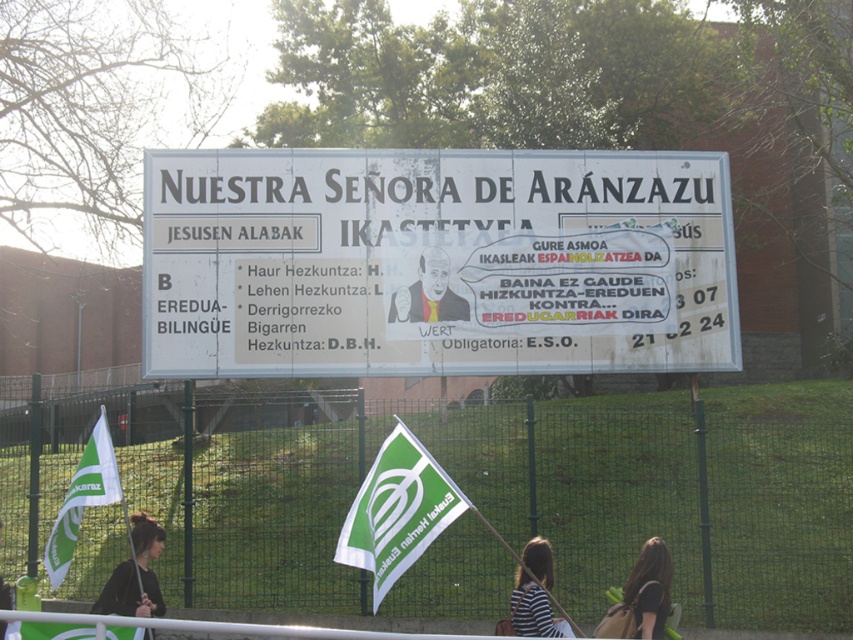
You are a tailor who needs to determine which fabric piece is larger between the black fabric at lower left and the striped fabric shirt at center for a custom order. Based on the billboard image, which one is larger?

The black fabric at lower left is bigger than the striped fabric shirt at center, so the larger fabric piece is the black fabric at lower left.

You are standing 10 meters away from the billboard and want to touch the black fabric at lower left. Is it possible to reach it without moving closer?

The black fabric at lower left is 11.44 meters away from the viewer. Since you are currently 10 meters away, you can move a little closer to reach it, but as you are currently 10 meters away, you are still 1.44 meters away from the fabric. Therefore, you cannot reach it without moving closer.